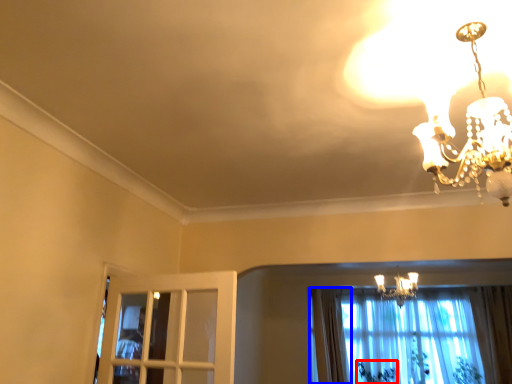
Question: Which object appears closest to the camera in this image, plant (highlighted by a red box) or curtain (highlighted by a blue box)?

Choices:
 (A) plant
 (B) curtain

Answer: (B)